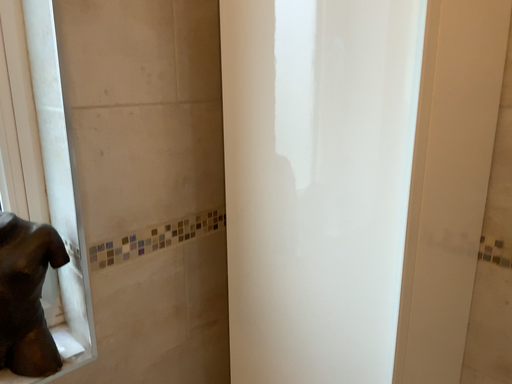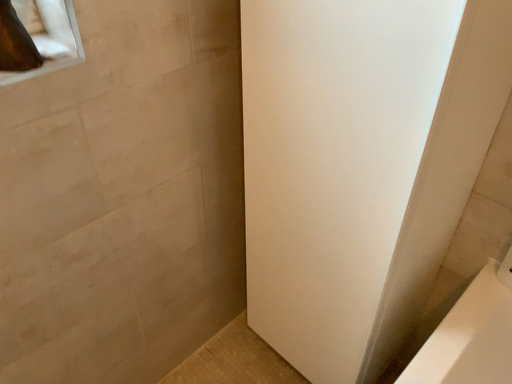
Question: Which way did the camera rotate in the video?

Choices:
 (A) rotated upward
 (B) rotated downward

Answer: (B)